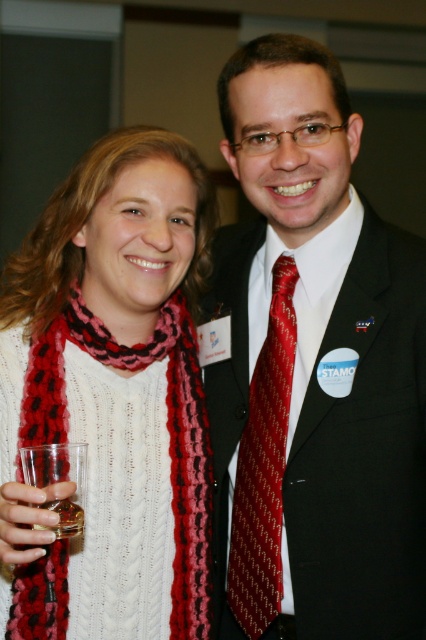
You are a photographer at a formal event. You need to adjust the lighting to ensure both the shiny red tie at center and the clear plastic glass at lower left are visible. Which object should you focus the light on first to highlight its details?

The shiny red tie at center should be focused on first because it is positioned above the clear plastic glass at lower left, making it more prominent in the frame.

You are a photographer trying to capture a clear photo of the shiny red tie at center and the shiny silk tie at center. The camera you are using has a depth of field that can focus on objects within a 4 inch range. Can both ties be in focus at the same time?

The distance between the shiny red tie at center and the shiny silk tie at center is 3.84 inches, which is within the 4 inch range of the camera. Therefore, both ties can be in focus simultaneously.